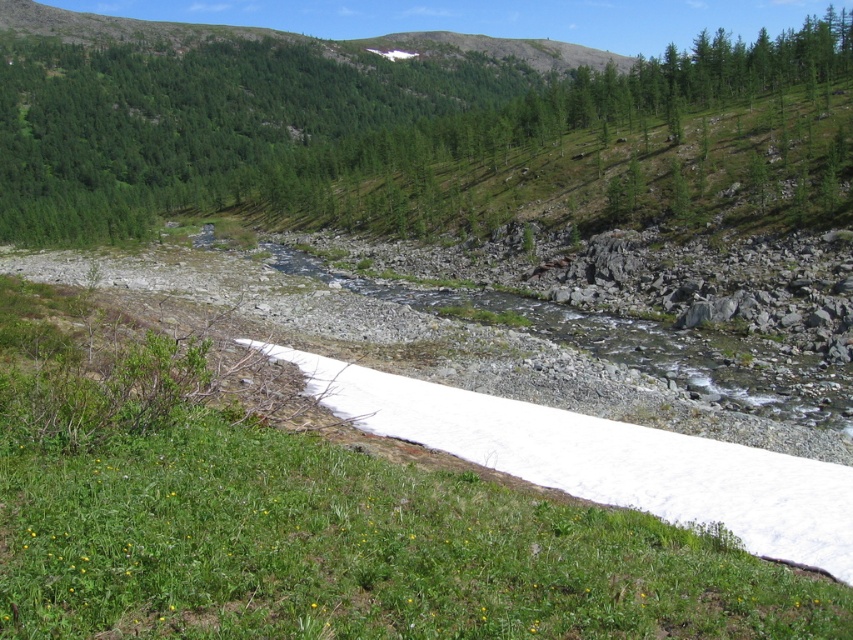
Describe the element at coordinates (416, 138) in the screenshot. I see `green textured tree at upper center` at that location.

Who is positioned more to the left, green textured tree at upper center or white powder snow at lower left?

green textured tree at upper center is more to the left.

Is point (534, 180) in front of point (508, 467)?

No, (534, 180) is behind (508, 467).

Identify the location of green textured tree at upper center. pyautogui.click(x=416, y=138).